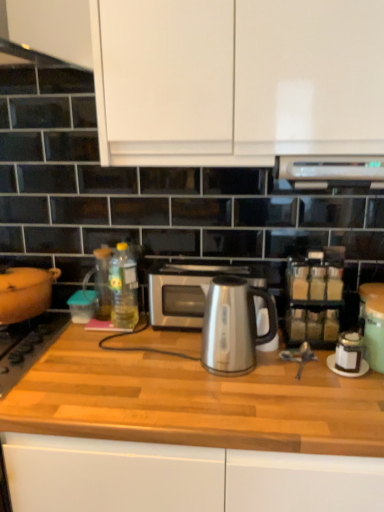
Locate an element on the screen. vacant area on top of satin silver microwave at center (from a real-world perspective) is located at coordinates (202, 267).